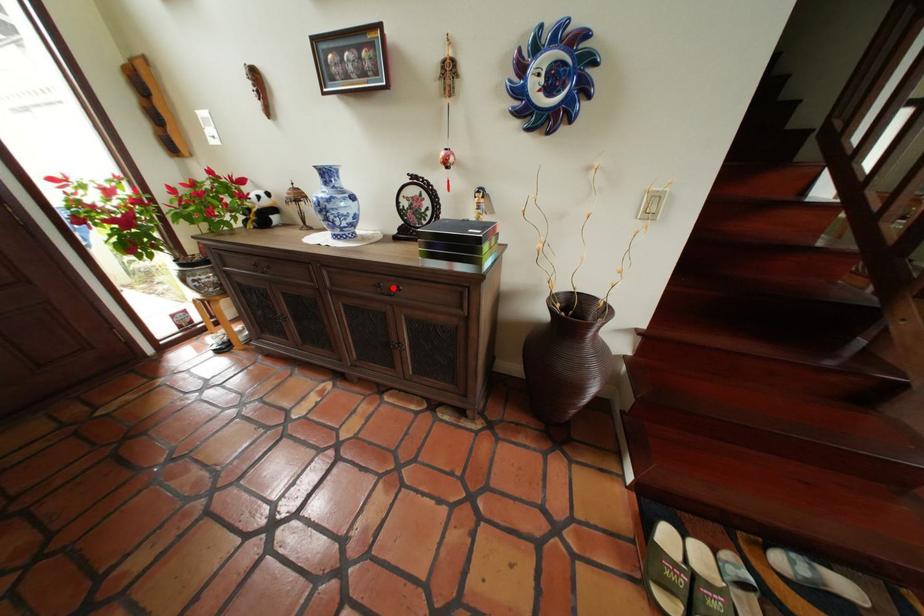
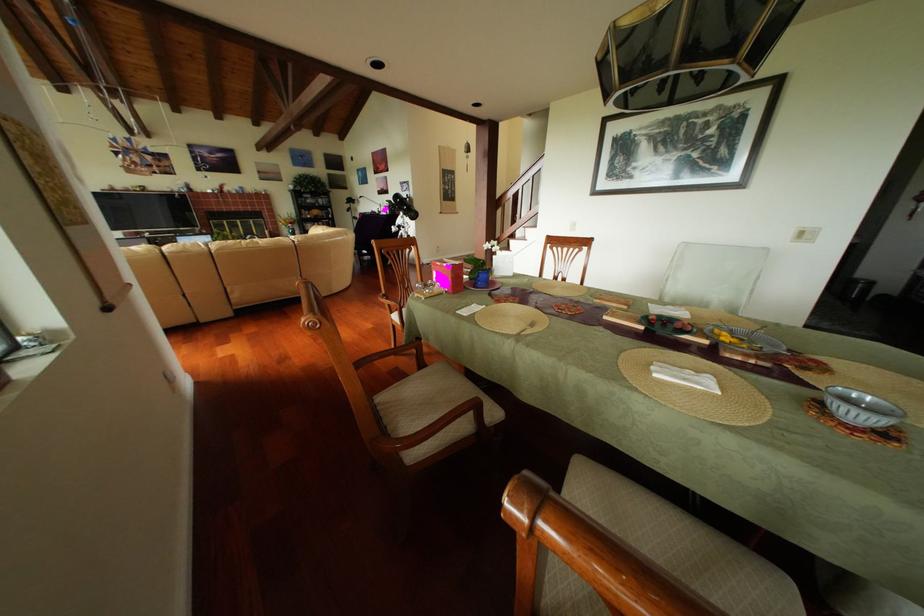
Question: I am providing you with two images of the same scene from different viewpoints. A red point is marked on the first image. At the location where the point appears in image 1, is it still visible in image 2?

Choices:
 (A) Yes
 (B) No

Answer: (B)